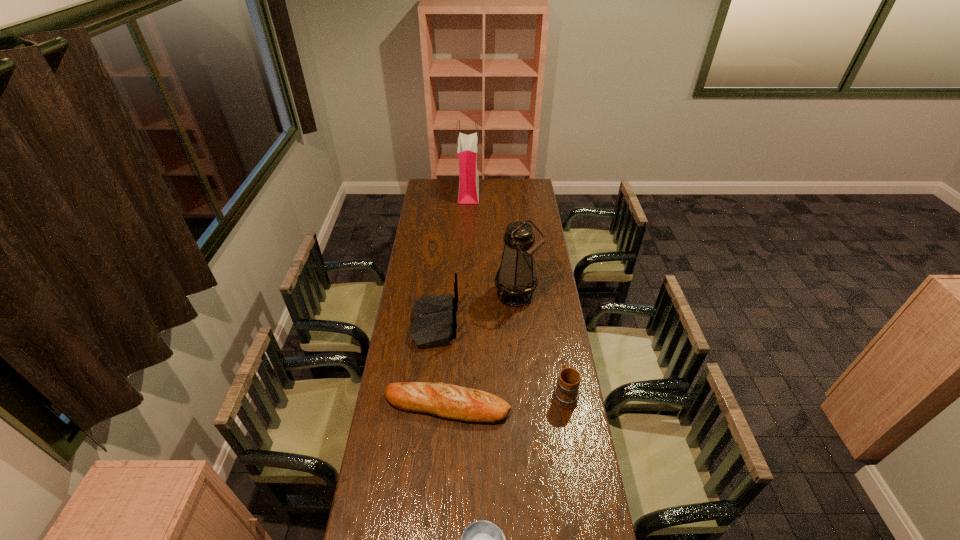
Where is `vacant area in the image that satisfies the following two spatial constraints: 1. on the front side of the oil lamp; 2. on the back of the router`? The width and height of the screenshot is (960, 540). vacant area in the image that satisfies the following two spatial constraints: 1. on the front side of the oil lamp; 2. on the back of the router is located at coordinates (519, 323).

This screenshot has height=540, width=960. Identify the location of free space that satisfies the following two spatial constraints: 1. on the side of the mug with the handle; 2. on the back of the router. (553, 323).

This screenshot has height=540, width=960. I want to click on vacant space that satisfies the following two spatial constraints: 1. on the back of the third tallest object; 2. on the side of the mug with the handle, so pyautogui.click(x=428, y=394).

Where is `free region that satisfies the following two spatial constraints: 1. on the front-facing side of the oil lamp; 2. on the left side of the farthest object`? This screenshot has width=960, height=540. free region that satisfies the following two spatial constraints: 1. on the front-facing side of the oil lamp; 2. on the left side of the farthest object is located at coordinates (465, 295).